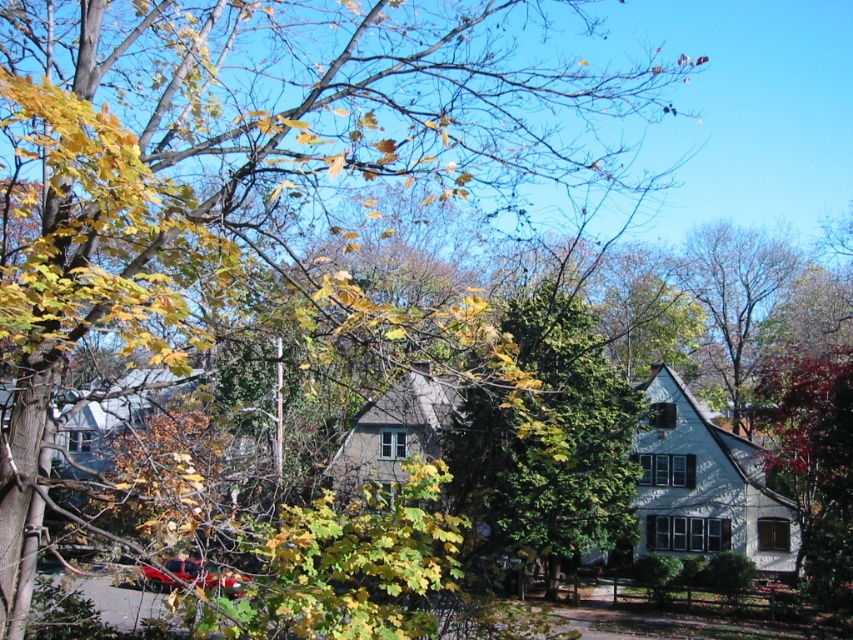
Question: Among these objects, which one is farthest from the camera?

Choices:
 (A) green textured tree at center
 (B) green leafy tree at upper right

Answer: (B)

Question: Among these points, which one is nearest to the camera?

Choices:
 (A) (729, 371)
 (B) (515, 324)

Answer: (B)

Question: Does green textured tree at center appear over green leafy tree at upper right?

Choices:
 (A) no
 (B) yes

Answer: (A)

Question: Can you confirm if green textured tree at center is positioned to the left of green leafy tree at upper right?

Choices:
 (A) yes
 (B) no

Answer: (A)

Question: Is green textured tree at center positioned behind green leafy tree at upper right?

Choices:
 (A) yes
 (B) no

Answer: (B)